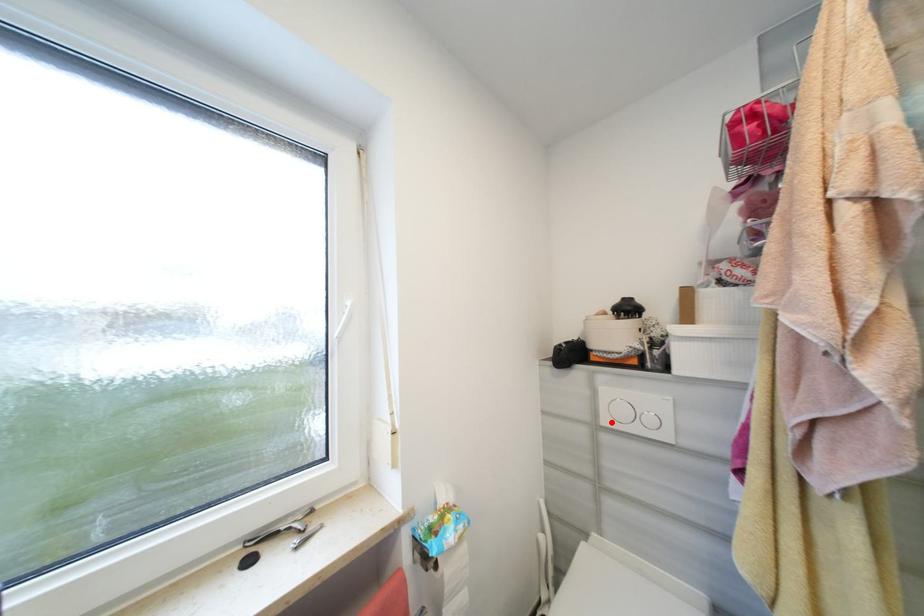
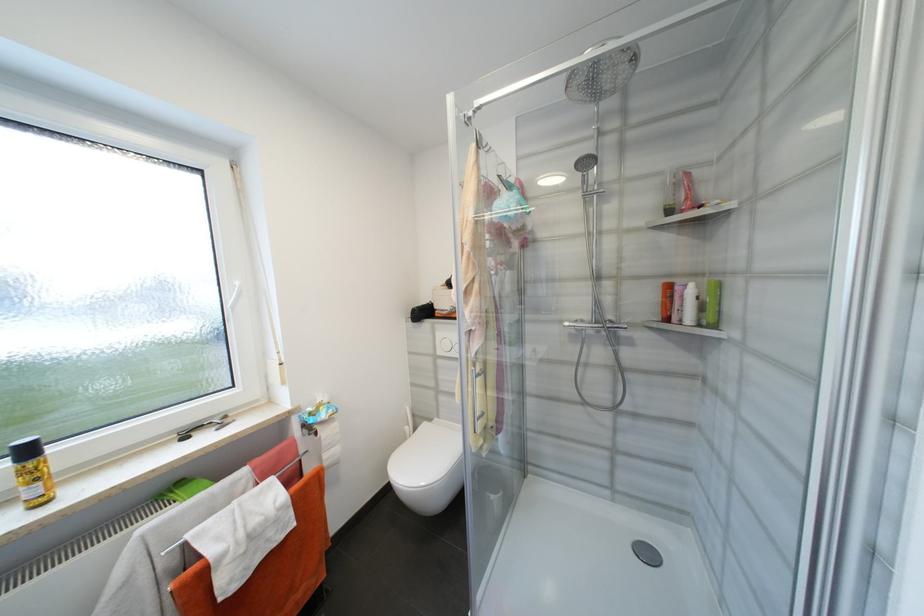
Locate, in the second image, the point that corresponds to the highlighted location in the first image.

(445, 353)